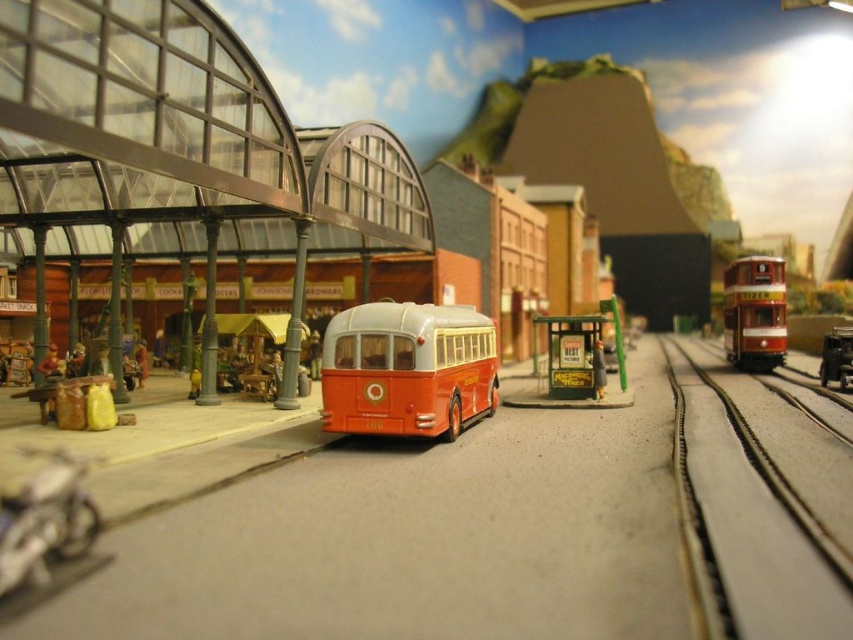
You are a miniature figure standing on the road next to the vintage bus. You need to cross to the market on the left. Which direction should you walk relative to the metallic silver train tracks at right and the red polished wood tram at right?

You should walk to the left of both the metallic silver train tracks at right and the red polished wood tram at right to reach the market on the left side of the bus.

You are a toy collector who wants to display both the matte orange bus at center and the red polished wood tram at right on a shelf. Based on their heights, which one should you place on the lower shelf to avoid blocking the view of the other?

The matte orange bus at center is shorter than the red polished wood tram at right, so placing the bus on the lower shelf will allow the tram to be seen above it without obstruction.

You are a town planner reviewing this miniature diorama. You need to determine if the matte orange bus at center can fit through the same gate that the red polished wood tram at right uses. Based on their sizes, what do you conclude?

The matte orange bus at center is larger than the red polished wood tram at right, so it may not fit through the same gate the tram uses.